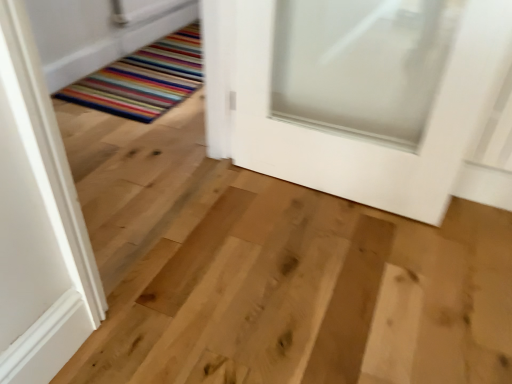
Question: Relative to white matte door at center, is multicolored striped rug at lower left in front or behind?

Choices:
 (A) front
 (B) behind

Answer: (B)

Question: Does point (195, 66) appear closer or farther from the camera than point (466, 153)?

Choices:
 (A) farther
 (B) closer

Answer: (A)

Question: In terms of width, does multicolored striped rug at lower left look wider or thinner when compared to white matte door at center?

Choices:
 (A) wide
 (B) thin

Answer: (A)

Question: From their relative heights in the image, would you say white matte door at center is taller or shorter than multicolored striped rug at lower left?

Choices:
 (A) short
 (B) tall

Answer: (B)

Question: From the image's perspective, is white matte door at center above or below multicolored striped rug at lower left?

Choices:
 (A) below
 (B) above

Answer: (A)

Question: Is white matte door at center spatially inside multicolored striped rug at lower left, or outside of it?

Choices:
 (A) inside
 (B) outside

Answer: (B)

Question: Visually, is white matte door at center positioned to the left or to the right of multicolored striped rug at lower left?

Choices:
 (A) left
 (B) right

Answer: (B)